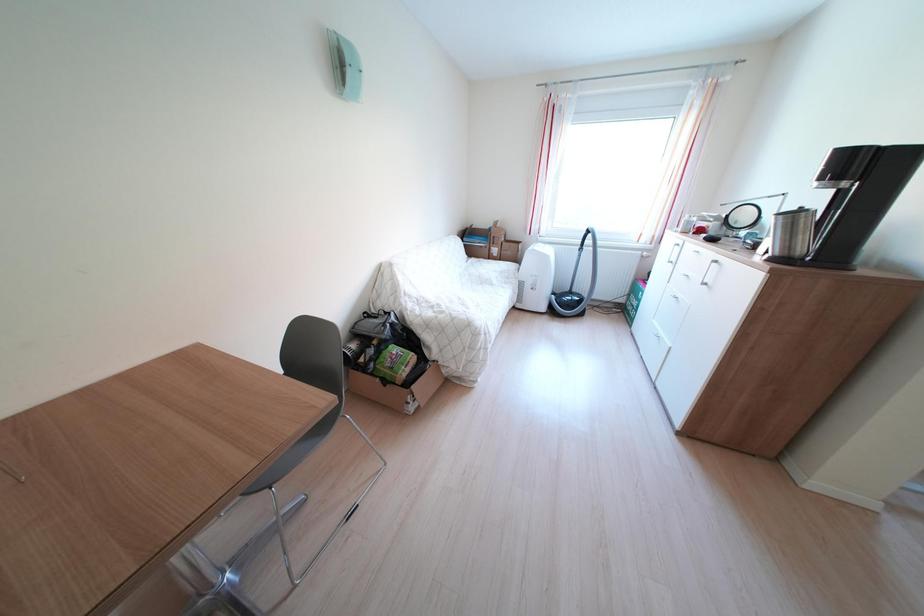
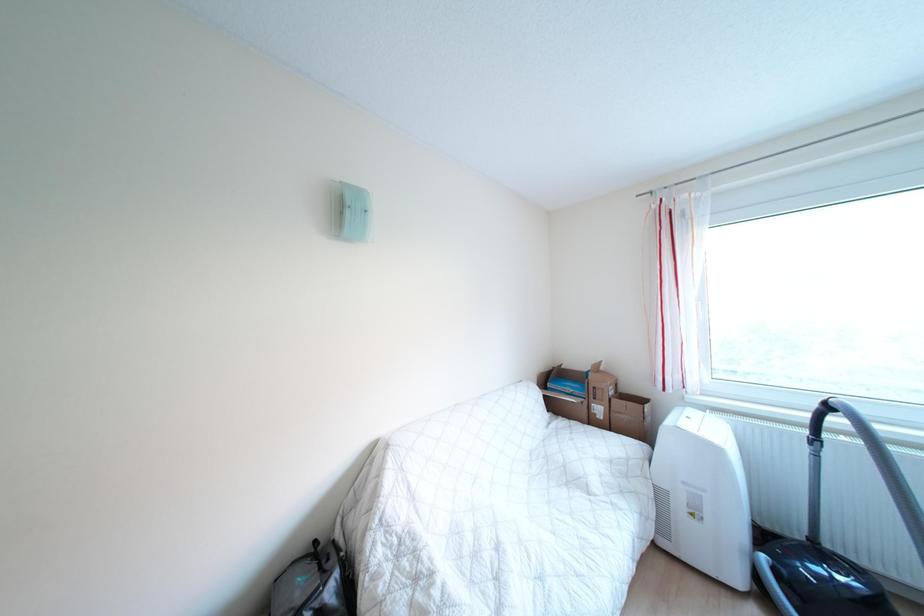
Consider the image. The first image is from the beginning of the video and the second image is from the end. How did the camera likely rotate when shooting the video?

The camera rotated toward left-up.